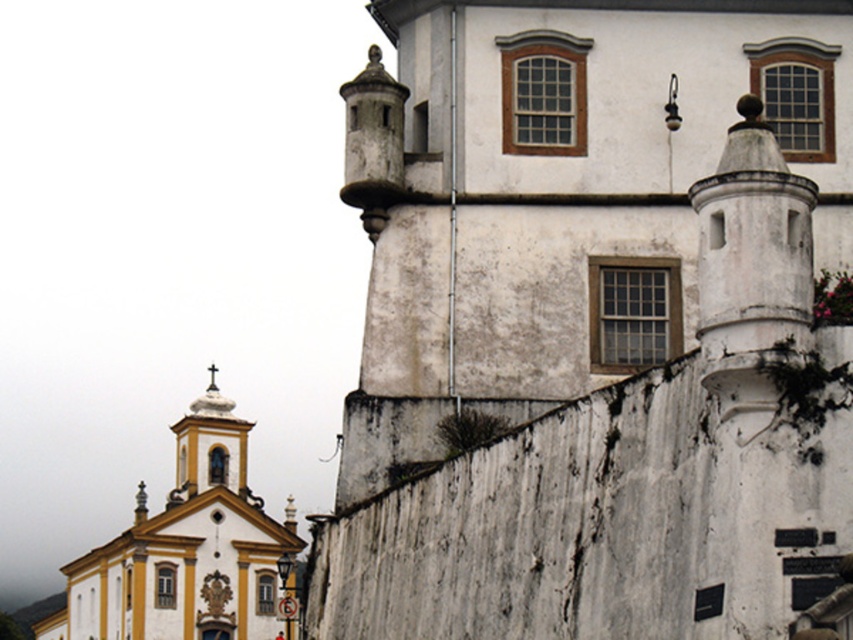
Does point (705, 317) lie in front of point (132, 605)?

Yes, it is in front of point (132, 605).

Looking at this image, can you confirm if white weathered stone church at center is shorter than yellow matte church at upper left?

Yes, white weathered stone church at center is shorter than yellow matte church at upper left.

Where is `white weathered stone church at center`? Image resolution: width=853 pixels, height=640 pixels. white weathered stone church at center is located at coordinates (596, 323).